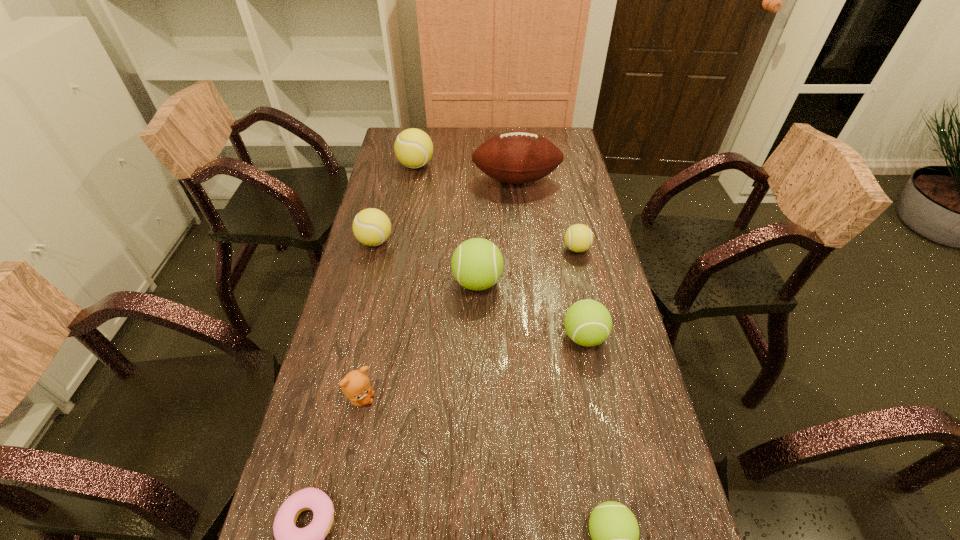
The image size is (960, 540). What are the coordinates of `football (American)` in the screenshot? It's located at (517, 157).

I want to click on brown football (American), so click(x=517, y=157).

Image resolution: width=960 pixels, height=540 pixels. What are the coordinates of `the farthest yellow tennis ball` in the screenshot? It's located at (413, 147).

Find the location of a particular element. The height and width of the screenshot is (540, 960). the biggest yellow tennis ball is located at coordinates click(x=413, y=147).

Identify the location of the fifth farthest object. Image resolution: width=960 pixels, height=540 pixels. 477,264.

Locate an element on the screen. the leftmost green tennis ball is located at coordinates (477, 264).

The width and height of the screenshot is (960, 540). I want to click on the second biggest yellow tennis ball, so click(372, 227).

Where is `the second biggest green tennis ball`? This screenshot has height=540, width=960. the second biggest green tennis ball is located at coordinates (588, 323).

Identify the location of the second nearest green tennis ball. (588, 323).

Identify the location of teddy bear. The image size is (960, 540). (355, 385).